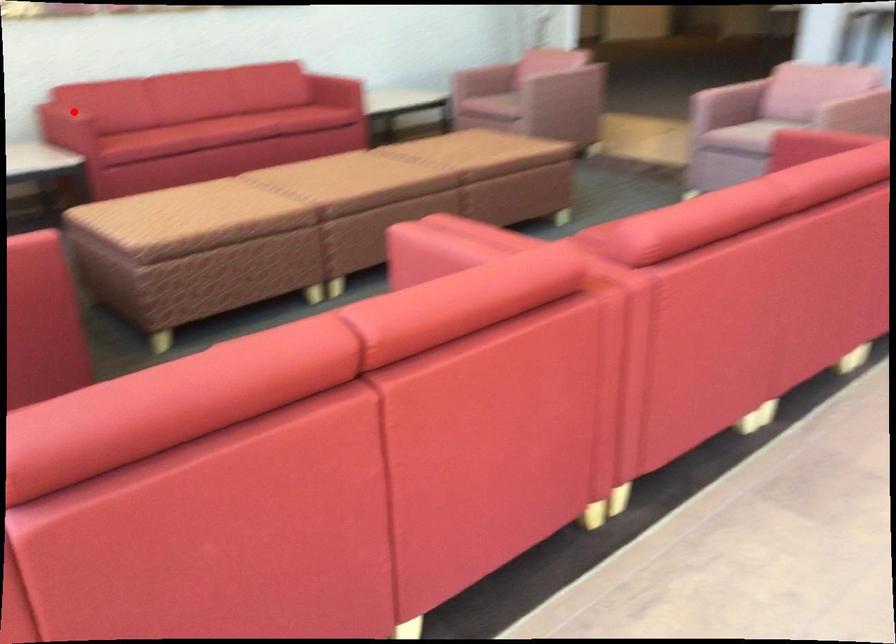
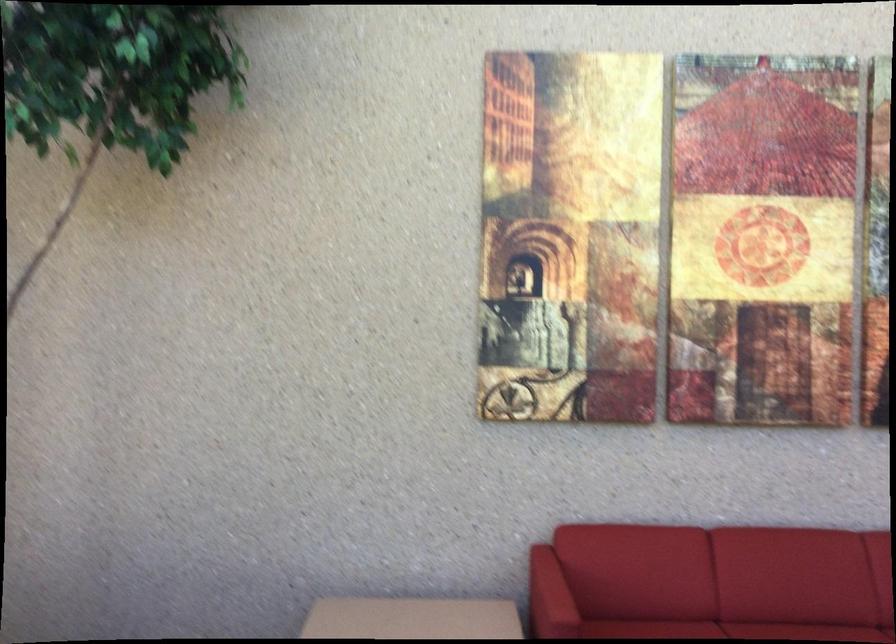
Where in the second image is the point corresponding to the highlighted location from the first image?

(549, 597)